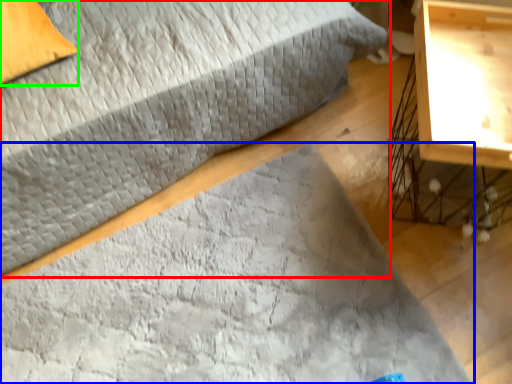
Question: Considering the real-world distances, which object is closest to bed (highlighted by a red box)? mat (highlighted by a blue box) or pillow (highlighted by a green box).

Choices:
 (A) mat
 (B) pillow

Answer: (B)